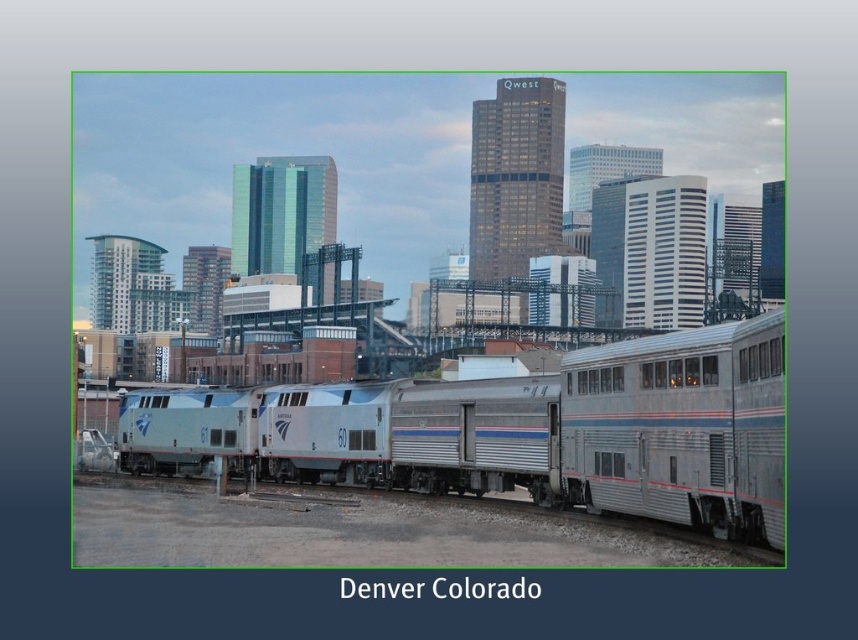
You are a photographer planning to capture the Denver skyline with both the silver metallic train at center and the silver metallic train car at center in your shot. Which object should you focus on to ensure the train is the main subject while still including the train car?

You should focus on the silver metallic train at center because it has a larger size compared to the silver metallic train car at center, making it the more prominent subject in the photograph.

You are a photographer trying to capture the Denver skyline in the background while photographing the silver metallic train at center and the silver metallic train car at center. Which object should you focus on first to ensure the skyline is clearly visible in the background?

The silver metallic train at center is positioned over silver metallic train car at center, so you should focus on the silver metallic train car at center first to ensure the skyline in the background is clearly visible.

What are the coordinates of the silver metallic train at center in the image?

The silver metallic train at center is located at coordinates point (559, 432).